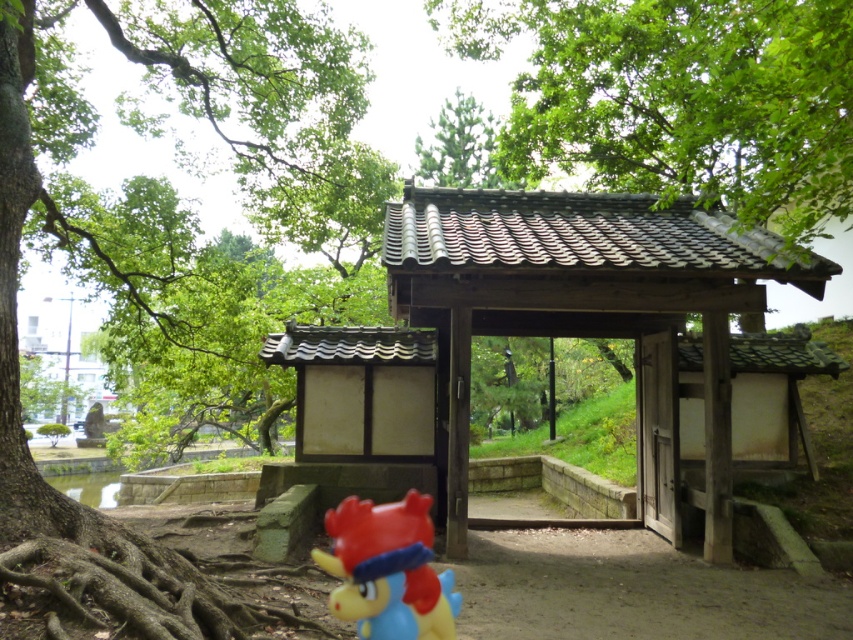
Which of these two, green leafy tree at left or rubberized red plush toy at lower center, stands shorter?

With less height is green leafy tree at left.

Does point (49, 552) come behind point (361, 516)?

That is True.

The image size is (853, 640). I want to click on green leafy tree at left, so click(28, 449).

In the scene shown: Can you confirm if wooden gate at center is shorter than rubberized red plush toy at lower center?

In fact, wooden gate at center may be taller than rubberized red plush toy at lower center.

Is wooden gate at center positioned in front of rubberized red plush toy at lower center?

That is False.

Is point (637, 221) positioned before point (387, 608)?

No, it is not.

You are a GUI agent. You are given a task and a screenshot of the screen. Output one action in this format:
    pyautogui.click(x=<x>, y=<y>)
    Task: Click on the wooden gate at center
    Image resolution: width=853 pixels, height=640 pixels.
    Given the screenshot: What is the action you would take?
    pyautogui.click(x=589, y=310)

Between point (0, 86) and point (494, 168), which one is positioned behind?

Point (494, 168)

Is green leafy tree at left taller than green matte tree at upper center?

Incorrect, green leafy tree at left's height is not larger of green matte tree at upper center's.

From the picture: Who is more forward, (x=26, y=140) or (x=447, y=148)?

Point (x=26, y=140)

This screenshot has height=640, width=853. Identify the location of green leafy tree at left. (28, 449).